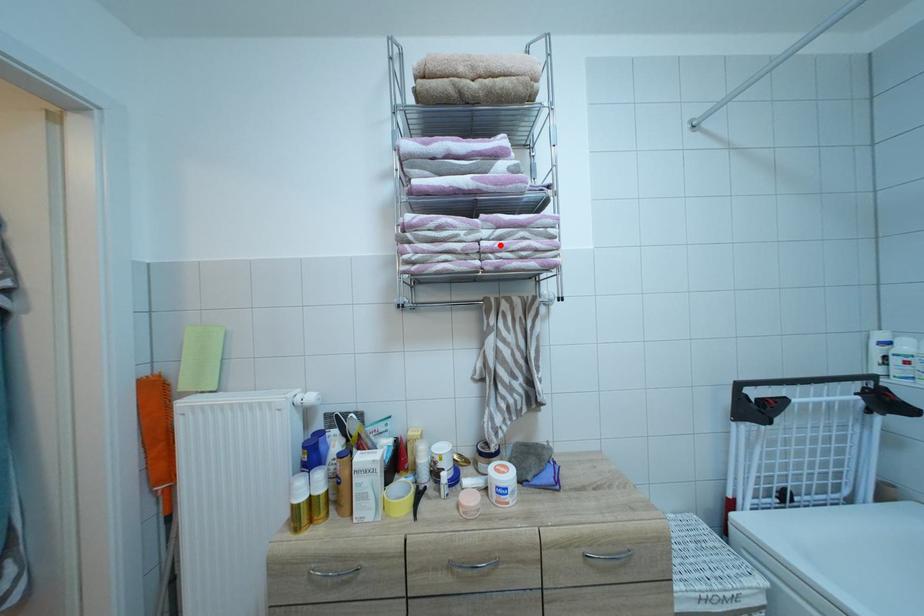
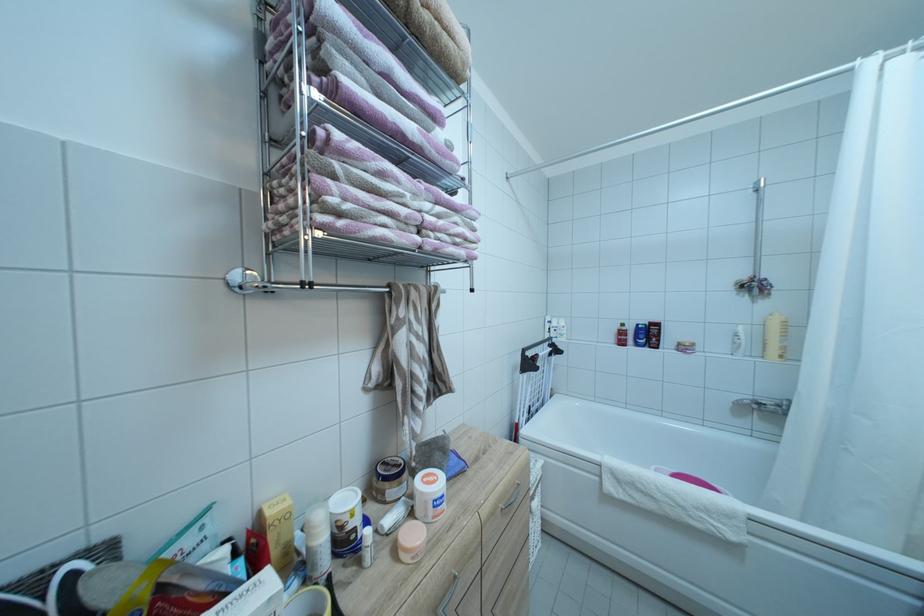
The point at the highlighted location is marked in the first image. Where is the corresponding point in the second image?

(440, 221)